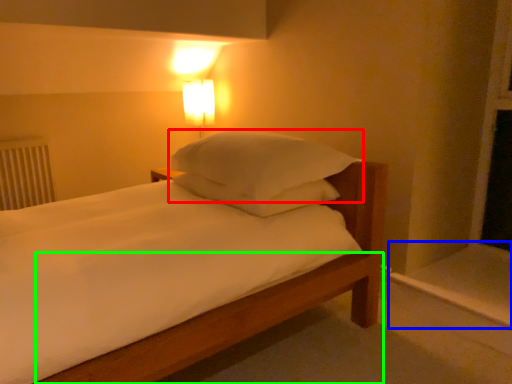
Question: Which is nearer to the pillow (highlighted by a red box)? window sill (highlighted by a blue box) or bed frame (highlighted by a green box).

Choices:
 (A) window sill
 (B) bed frame

Answer: (B)